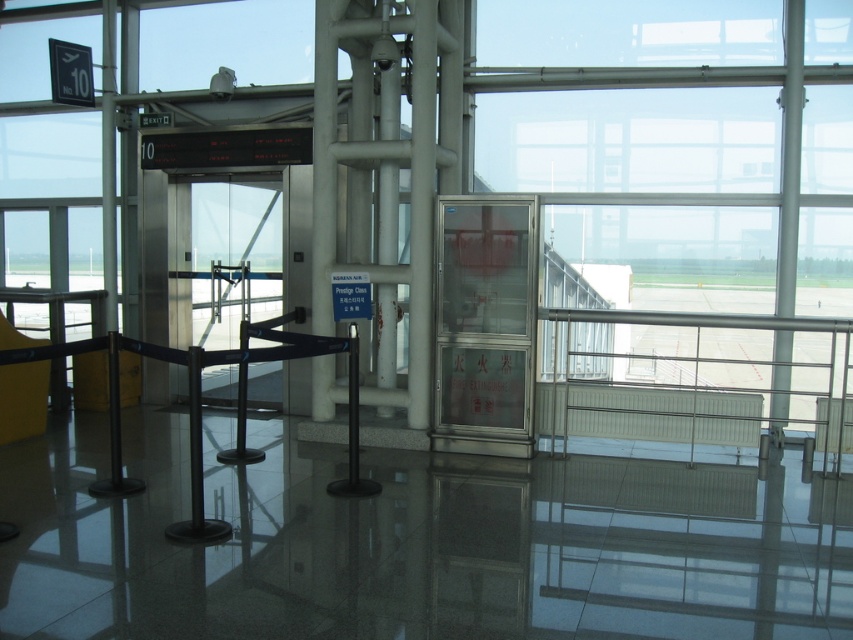
Question: Which point is farther from the camera taking this photo?

Choices:
 (A) (450, 307)
 (B) (723, 204)

Answer: (B)

Question: Can you confirm if transparent glass window at center is positioned to the right of transparent glass fire extinguisher at center?

Choices:
 (A) yes
 (B) no

Answer: (A)

Question: Does transparent glass window at center have a smaller size compared to transparent glass fire extinguisher at center?

Choices:
 (A) no
 (B) yes

Answer: (A)

Question: Which of the following is the farthest from the observer?

Choices:
 (A) (467, 392)
 (B) (730, 276)

Answer: (B)

Question: Is transparent glass window at center thinner than transparent glass fire extinguisher at center?

Choices:
 (A) yes
 (B) no

Answer: (B)